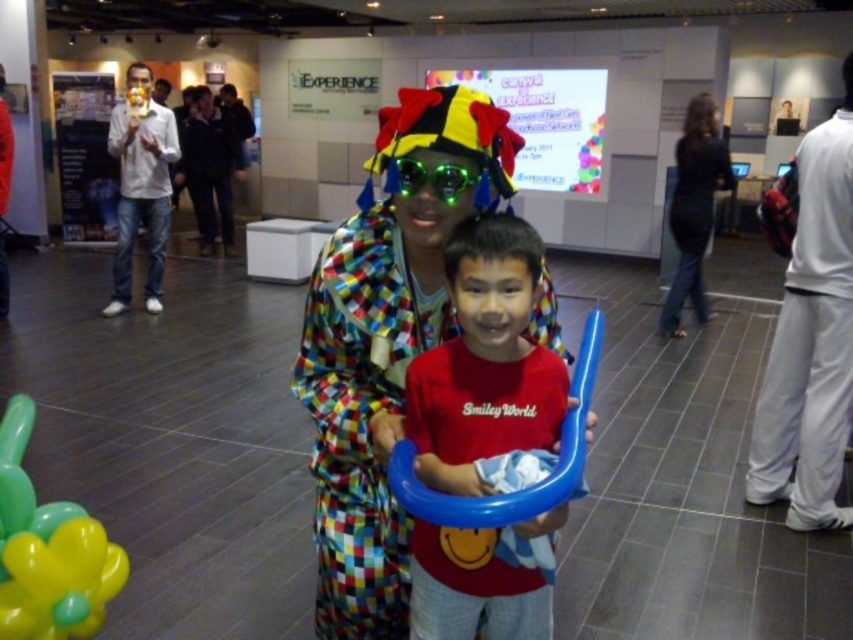
Question: Does dark blue jeans at center have a greater width compared to multicolored fabric clown at center?

Choices:
 (A) yes
 (B) no

Answer: (A)

Question: Which of the following is the closest to the observer?

Choices:
 (A) rubber balloon at lower left
 (B) black fabric dress at right

Answer: (A)

Question: Is matte red t-shirt at center below multicolored fabric clown at center?

Choices:
 (A) yes
 (B) no

Answer: (A)

Question: Estimate the real-world distances between objects in this image. Which object is farther from the matte white shirt at left?

Choices:
 (A) rubber balloon at lower left
 (B) dark blue jeans at center
 (C) black fabric dress at right

Answer: (A)

Question: Which object is the closest to the matte red t-shirt at center?

Choices:
 (A) white fabric pants at right
 (B) dark blue jeans at center

Answer: (A)

Question: Does matte red t-shirt at center come in front of matte white shirt at left?

Choices:
 (A) no
 (B) yes

Answer: (B)